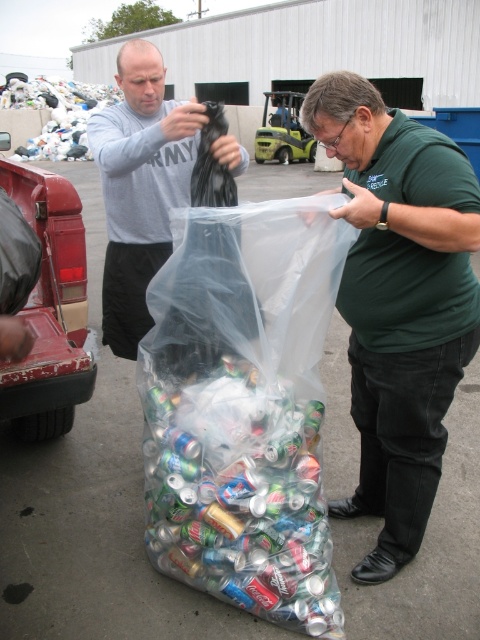
You are a photographer trying to capture both the gray matte shirt at upper left and the plastic bag at upper left in a single frame. Based on their sizes, which object should you focus on to ensure both fit in the frame without cropping?

The gray matte shirt at upper left is narrower than the plastic bag at upper left, so focusing on the plastic bag at upper left ensures both fit without cropping since it is wider.

You are standing at the origin point of the image coordinate system. Where is the translucent plastic bag at center located?

The translucent plastic bag at center is located at point (243,406) in the image coordinate system.

You are a delivery person who needs to place a large box on the ground. You see the translucent plastic bag at center and the green matte shirt at center. Which object is smaller and can be moved out of the way to make space?

The translucent plastic bag at center is smaller than the green matte shirt at center, so you can move the translucent plastic bag at center to make space.